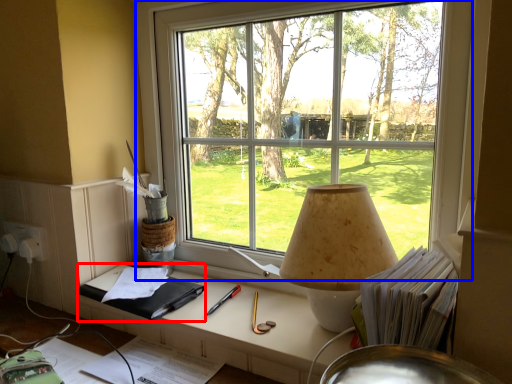
Question: Which point is closer to the camera, notebook (highlighted by a red box) or window (highlighted by a blue box)?

Choices:
 (A) notebook
 (B) window

Answer: (B)